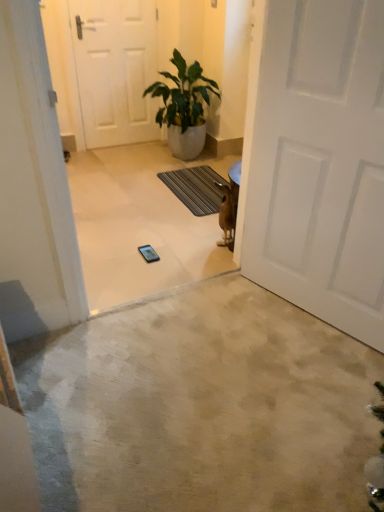
Question: From the image's perspective, relative to beige carpet at center, is dark gray textured mat at center above or below?

Choices:
 (A) above
 (B) below

Answer: (A)

Question: Is dark gray textured mat at center to the left or to the right of beige carpet at center in the image?

Choices:
 (A) right
 (B) left

Answer: (B)

Question: Which object is the closest to the white matte door at center, marked as the first door in a right-to-left arrangement?

Choices:
 (A) beige carpet at center
 (B) green glossy plant at center
 (C) white matte door at upper center, which is the first door in left-to-right order
 (D) dark gray textured mat at center

Answer: (A)

Question: Which of these objects is positioned closest to the white matte door at center, marked as the first door in a right-to-left arrangement?

Choices:
 (A) dark gray textured mat at center
 (B) green glossy plant at center
 (C) beige carpet at center
 (D) white matte door at upper center, marked as the first door in a back-to-front arrangement

Answer: (C)